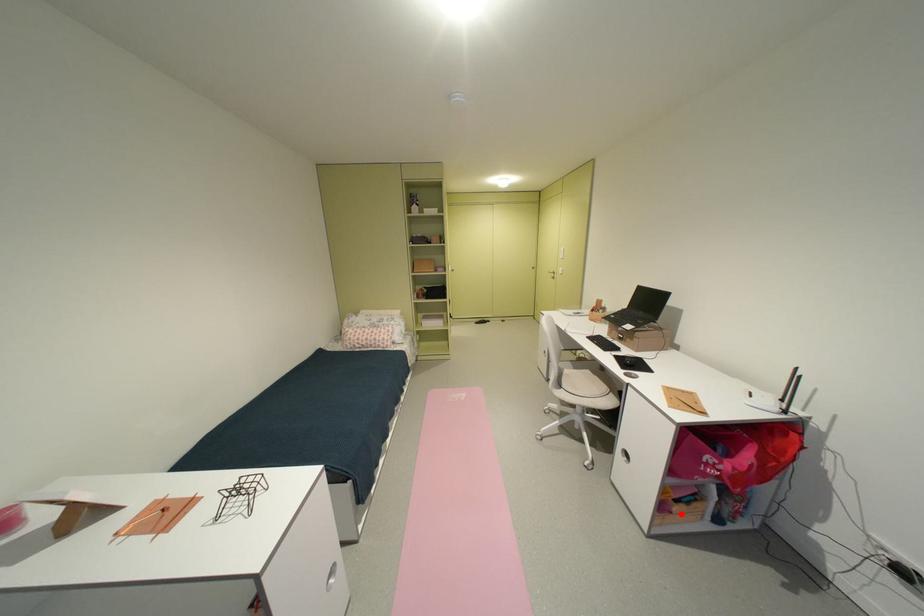
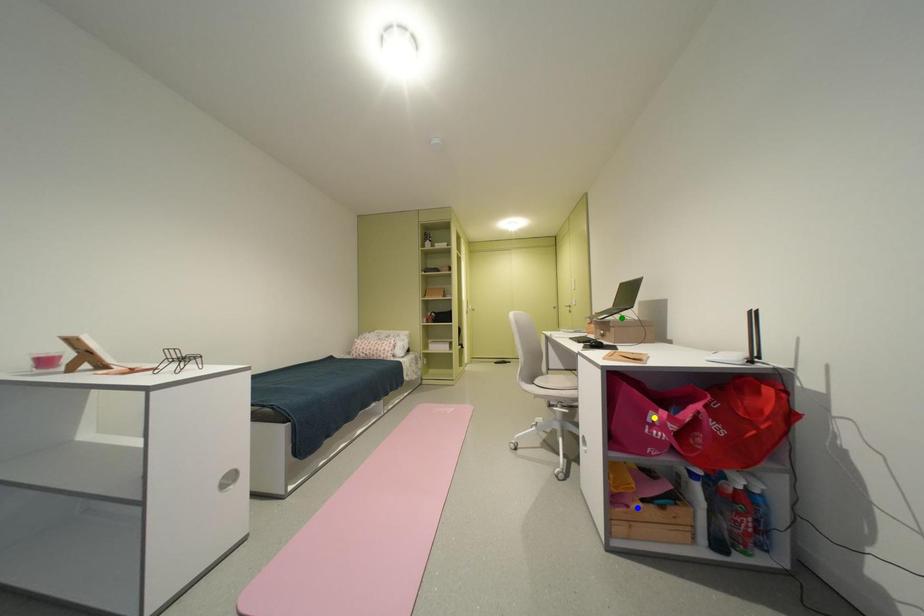
Question: I am providing you with two images of the same scene from different viewpoints. A red point is marked on the first image. You are given multiple points on the second image. Which point in image 2 represents the same 3d spot as the red point in image 1?

Choices:
 (A) yellow point
 (B) green point
 (C) blue point

Answer: (C)